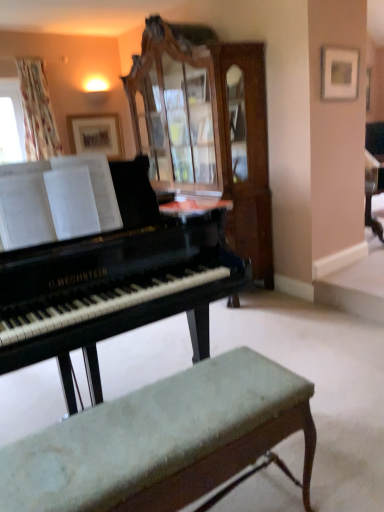
Question: Would you say black polished piano at center contains orange glossy table at center?

Choices:
 (A) no
 (B) yes

Answer: (B)

Question: Is black polished piano at center located outside orange glossy table at center?

Choices:
 (A) yes
 (B) no

Answer: (A)

Question: Is black polished piano at center turned away from orange glossy table at center?

Choices:
 (A) no
 (B) yes

Answer: (A)

Question: Considering the relative sizes of black polished piano at center and orange glossy table at center in the image provided, is black polished piano at center thinner than orange glossy table at center?

Choices:
 (A) yes
 (B) no

Answer: (B)

Question: From the image's perspective, does black polished piano at center appear higher than orange glossy table at center?

Choices:
 (A) no
 (B) yes

Answer: (A)

Question: From the image's perspective, is matte white picture frame at upper right, acting as the 1th picture frame starting from the right, above or below matte wooden picture frame at upper center, which appears as the 2th picture frame when viewed from the right?

Choices:
 (A) above
 (B) below

Answer: (B)

Question: Based on their positions, is matte white picture frame at upper right, the 2th picture frame from the left, located to the left or right of matte wooden picture frame at upper center, placed as the first picture frame when sorted from left to right?

Choices:
 (A) right
 (B) left

Answer: (A)

Question: In terms of size, does matte white picture frame at upper right, the 1th picture frame when ordered from front to back, appear bigger or smaller than matte wooden picture frame at upper center, which appears as the 2th picture frame when viewed from the right?

Choices:
 (A) small
 (B) big

Answer: (A)

Question: In terms of height, does matte white picture frame at upper right, the second picture frame from the back, look taller or shorter compared to matte wooden picture frame at upper center, which appears as the 2th picture frame when viewed from the right?

Choices:
 (A) short
 (B) tall

Answer: (A)

Question: Relative to matte white picture frame at upper right, the 1th picture frame when ordered from front to back, is matte wooden picture frame at upper center, placed as the first picture frame when sorted from left to right, in front or behind?

Choices:
 (A) front
 (B) behind

Answer: (B)

Question: Is point (109, 115) positioned closer to the camera than point (342, 79)?

Choices:
 (A) closer
 (B) farther

Answer: (B)

Question: Based on their sizes in the image, would you say matte wooden picture frame at upper center, placed as the first picture frame when sorted from left to right, is bigger or smaller than matte white picture frame at upper right, the 1th picture frame when ordered from front to back?

Choices:
 (A) small
 (B) big

Answer: (B)

Question: From the image's perspective, is matte wooden picture frame at upper center, marked as the 2th picture frame in a front-to-back arrangement, above or below matte white picture frame at upper right, acting as the 1th picture frame starting from the right?

Choices:
 (A) above
 (B) below

Answer: (A)

Question: In terms of height, does black polished piano at center look taller or shorter compared to matte white picture frame at upper right, acting as the 1th picture frame starting from the right?

Choices:
 (A) tall
 (B) short

Answer: (A)

Question: From a real-world perspective, is black polished piano at center positioned above or below matte white picture frame at upper right, the second picture frame from the back?

Choices:
 (A) above
 (B) below

Answer: (B)